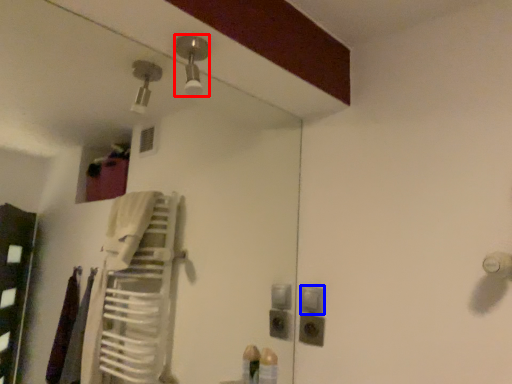
Question: Which point is closer to the camera, light fixture (highlighted by a red box) or light switch (highlighted by a blue box)?

Choices:
 (A) light fixture
 (B) light switch

Answer: (A)